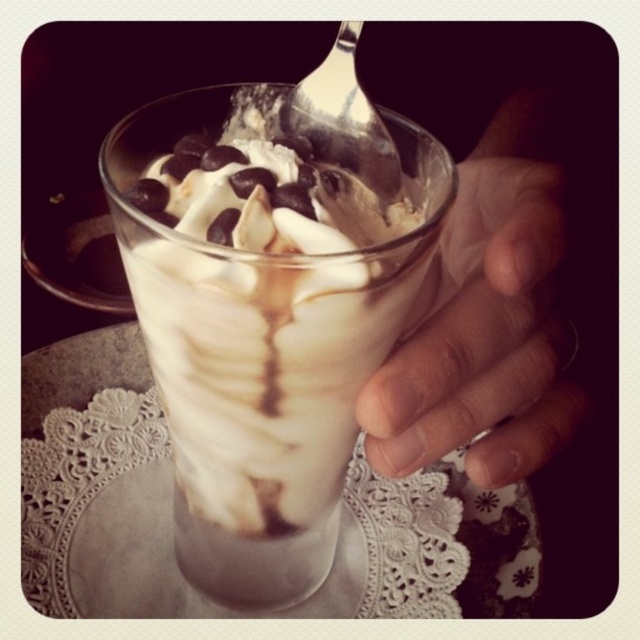
Who is positioned more to the right, smooth skin hand at right or silver metallic spoon at upper center?

smooth skin hand at right

Is point (474, 429) less distant than point (296, 120)?

Yes, point (474, 429) is closer to viewer.

Find the location of a particular element. This screenshot has height=640, width=640. smooth skin hand at right is located at coordinates (484, 333).